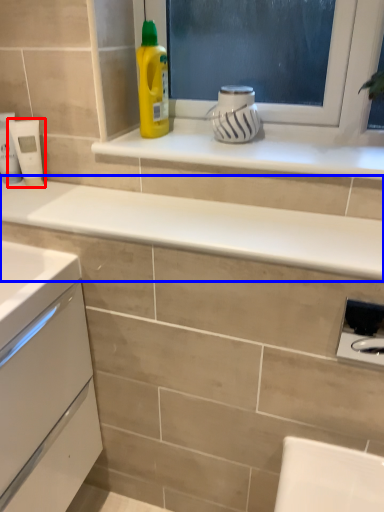
Question: Which object appears closest to the camera in this image, appliance (highlighted by a red box) or countertop (highlighted by a blue box)?

Choices:
 (A) appliance
 (B) countertop

Answer: (B)